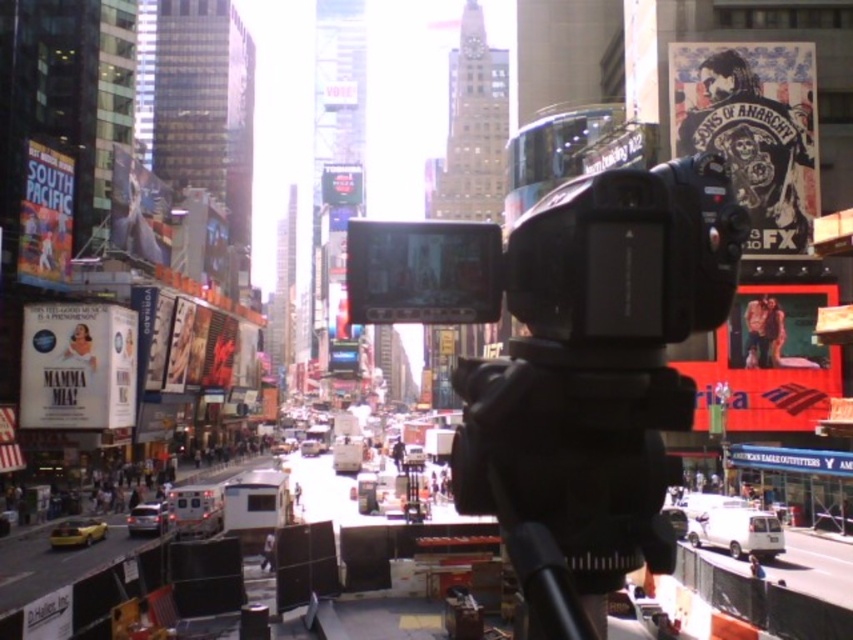
Question: Does black plastic video camera at center appear under metallic silver van at lower left?

Choices:
 (A) yes
 (B) no

Answer: (B)

Question: Estimate the real-world distances between objects in this image. Which object is closer to the black plastic video camera at center?

Choices:
 (A) metallic silver van at lower left
 (B) black matte tripod at center

Answer: (B)

Question: Considering the relative positions of black matte tripod at center and metallic silver van at lower left in the image provided, where is black matte tripod at center located with respect to metallic silver van at lower left?

Choices:
 (A) above
 (B) below

Answer: (A)

Question: Does black matte tripod at center have a larger size compared to metallic silver van at lower left?

Choices:
 (A) no
 (B) yes

Answer: (A)

Question: Which of the following is the farthest from the observer?

Choices:
 (A) black matte tripod at center
 (B) metallic silver van at lower left

Answer: (B)

Question: Which object is closer to the camera taking this photo?

Choices:
 (A) metallic silver van at lower left
 (B) black plastic video camera at center

Answer: (B)